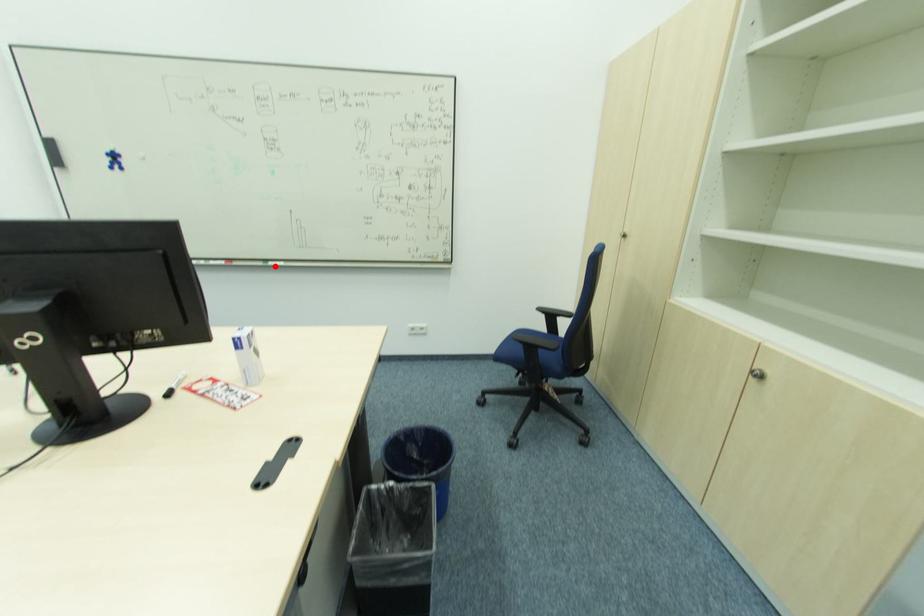
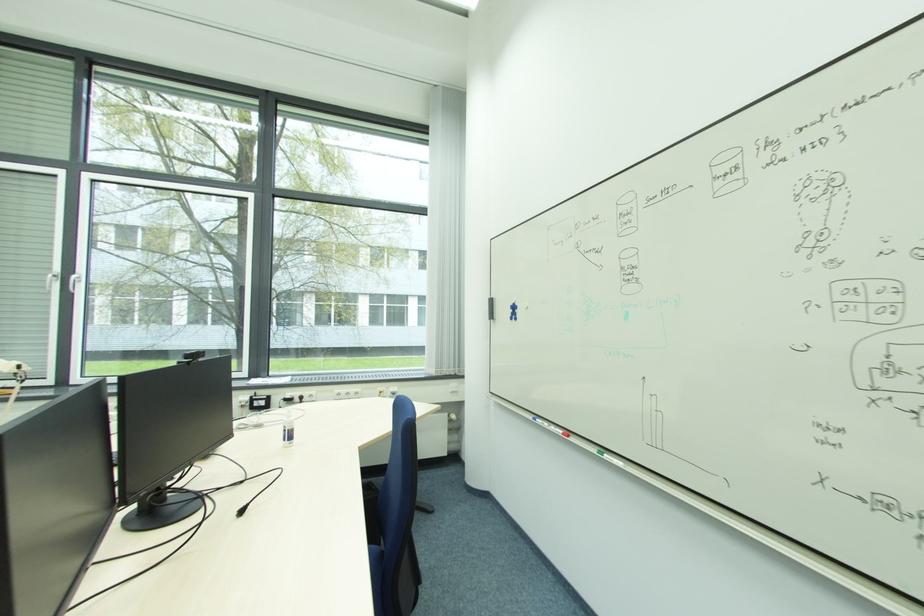
The point at the highlighted location is marked in the first image. Where is the corresponding point in the second image?

(610, 458)